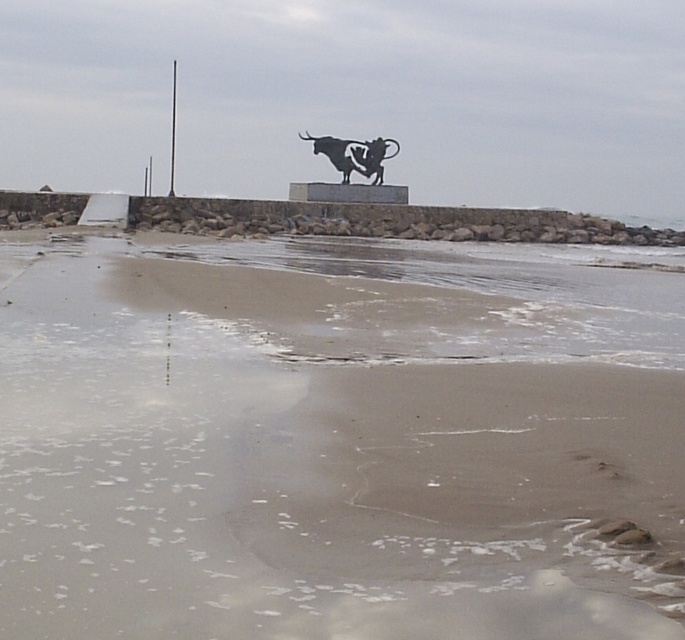
Question: Which of these objects is positioned closest to the black metal bull at upper center?

Choices:
 (A) sandy at center
 (B) smooth metal pole at upper center

Answer: (B)

Question: Is sandy at center to the right of black metal bull at upper center from the viewer's perspective?

Choices:
 (A) no
 (B) yes

Answer: (B)

Question: Which object is closer to the camera taking this photo?

Choices:
 (A) smooth metal pole at upper center
 (B) black metal bull at upper center
 (C) sandy at center

Answer: (C)

Question: Which point appears closest to the camera in this image?

Choices:
 (A) (351, 154)
 (B) (173, 164)

Answer: (A)

Question: Can you confirm if black metal bull at upper center is positioned to the left of smooth metal pole at upper center?

Choices:
 (A) no
 (B) yes

Answer: (A)

Question: Does sandy at center lie in front of smooth metal pole at upper center?

Choices:
 (A) no
 (B) yes

Answer: (B)